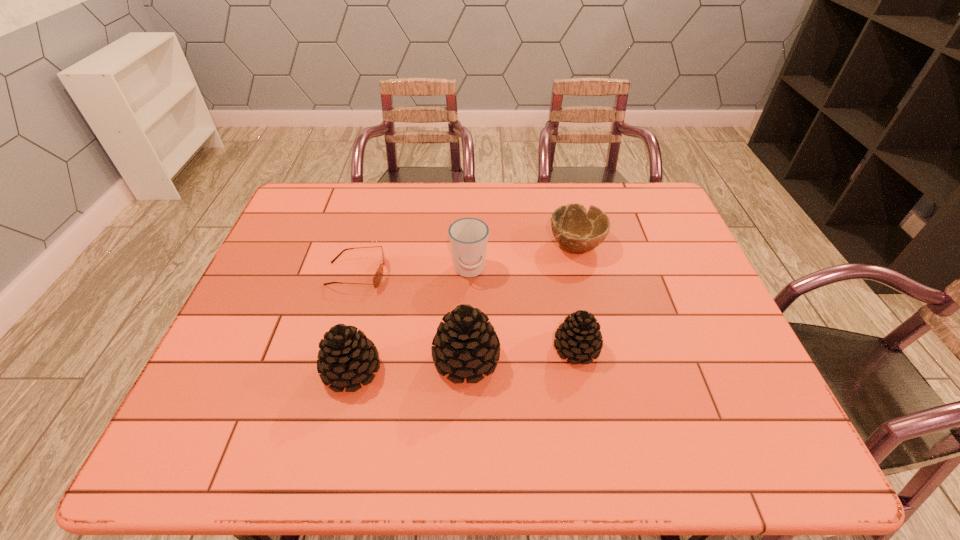
This screenshot has height=540, width=960. I want to click on vacant region that satisfies the following two spatial constraints: 1. with a handle on the side of the cup; 2. on the front-facing side of the sunglasses, so click(x=469, y=274).